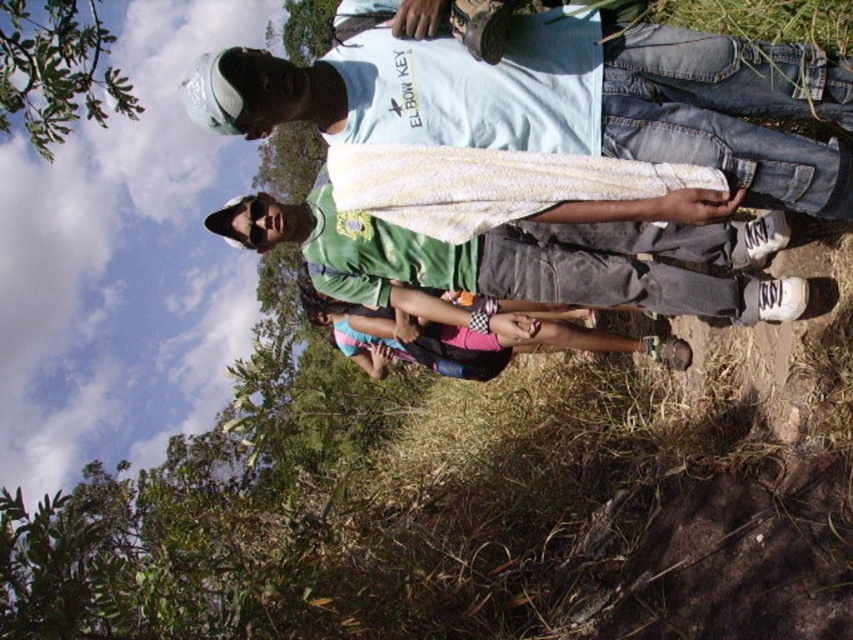
You are a photographer trying to capture a candid shot of the group. You notice the white textured towel at center might be in the way of your desired composition. Can you estimate its position relative to the center of the image using coordinates?

The white textured towel at center is located at point coordinates of 0.156 on the x axis and 0.658 on the y axis.

You are a photographer trying to capture a clear shot of the white textured towel at center and the green fabric shirt at center. Since you want both subjects to be in focus, which one should you adjust your camera focus on first?

The white textured towel at center is in front of the green fabric shirt at center, so you should focus on the white textured towel at center first to ensure both are in focus.